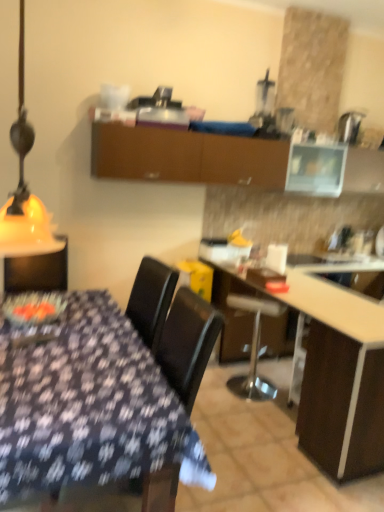
Question: From the image's perspective, is yellow matte lampshade at left above or below metallic silver bar stool at center?

Choices:
 (A) below
 (B) above

Answer: (B)

Question: Is yellow matte lampshade at left inside or outside of metallic silver bar stool at center?

Choices:
 (A) inside
 (B) outside

Answer: (B)

Question: Which object is the farthest from the metallic silver bar stool at center?

Choices:
 (A) black matte chair at center
 (B) brown matte cabinet at upper center
 (C) wooden table at center
 (D) yellow matte lampshade at left
 (E) white glossy countertop at center

Answer: (D)

Question: Which is nearer to the brown matte cabinet at upper center?

Choices:
 (A) black matte chair at center
 (B) yellow matte lampshade at left
 (C) metallic silver bar stool at center
 (D) wooden table at center
 (E) white glossy countertop at center

Answer: (E)